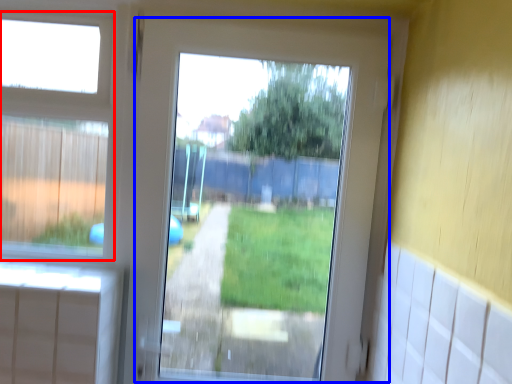
Question: Which of the following is the farthest to the observer, bay window (highlighted by a red box) or screen door (highlighted by a blue box)?

Choices:
 (A) bay window
 (B) screen door

Answer: (A)